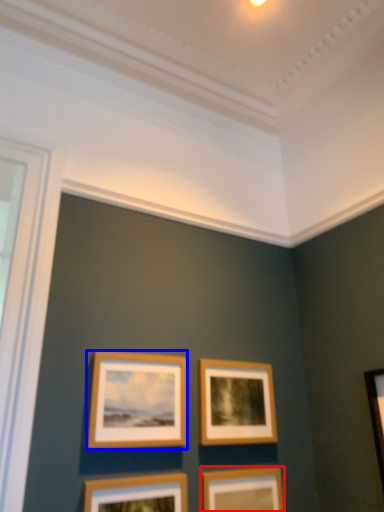
Question: Among these objects, which one is nearest to the camera, picture frame (highlighted by a red box) or picture frame (highlighted by a blue box)?

Choices:
 (A) picture frame
 (B) picture frame

Answer: (B)